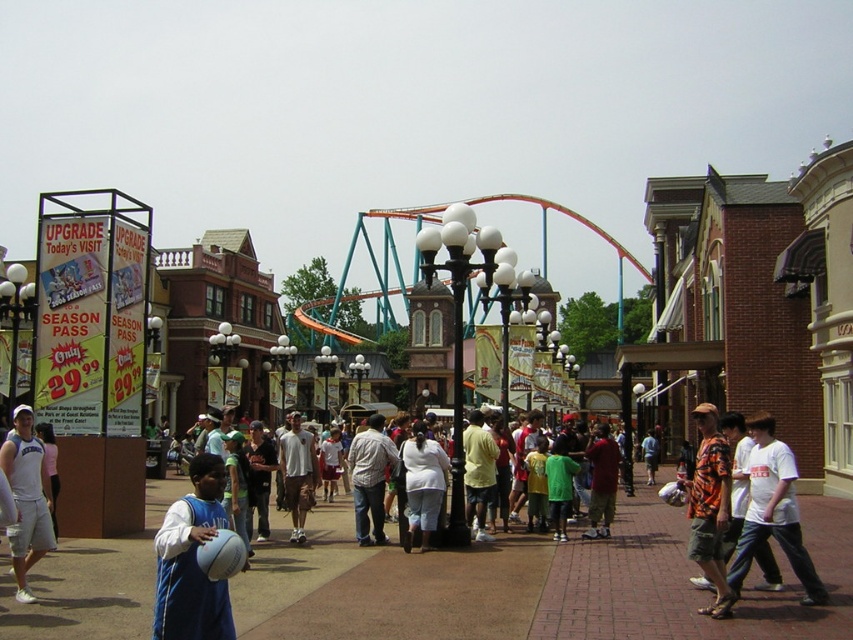
You are a photographer wanting to capture a clear shot of the orange printed shirt at center and the white matte pants at center. Since you want to focus on the shirt, which object should you zoom in on more and why?

The orange printed shirt at center is larger in size than the white matte pants at center, so you should zoom in on the orange printed shirt at center to ensure it remains the main focus of the photo.

You are a photographer positioned at the edge of the crowd, aiming to capture both the matte blue jersey at center and the white cotton shirt at center in a single frame. Which of the two clothing items should you focus on first to ensure both are in clear view, considering their sizes?

Since the matte blue jersey at center is smaller in size compared to the white cotton shirt at center, you should focus on the matte blue jersey at center first to ensure its details are sharp before adjusting for the larger white cotton shirt at center.